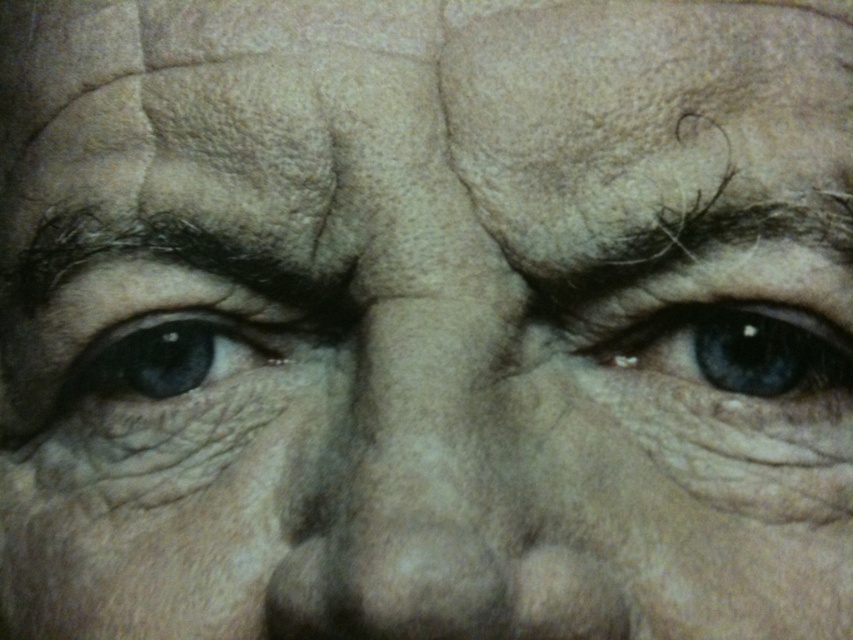
You are a photographer standing 12 inches away from the subject. You want to take a closeup shot of the blue matte eye at center. Is the current distance sufficient to capture the eye clearly?

The blue matte eye at center is 13.28 inches away from the viewer. Since you are standing 12 inches away, you are closer than the required distance, so you need to move back to 13.28 inches to capture it clearly.

You are an artist trying to draw this portrait. You notice two blue matte eyes in the image. Which one appears closer to you, the blue matte eye at center or the matte blue eye at left?

The blue matte eye at center appears closer because it is positioned in front of the matte blue eye at left.

You are a photographer using a camera with a 12.5 inch focal length lens. You are taking a closeup portrait focusing on the eyes and forehead of an elderly person. The camera is positioned such that the lens is exactly at point (740, 346). Can you determine if the focal length of your lens is sufficient to capture a sharp image of the subject at this distance?

The distance between the lens at point (740, 346) and the subject is 13.87 inches. Since the focal length of the lens is 12.5 inches, which is shorter than the distance to the subject, the image can be captured sharply as long as the lens is focused properly.